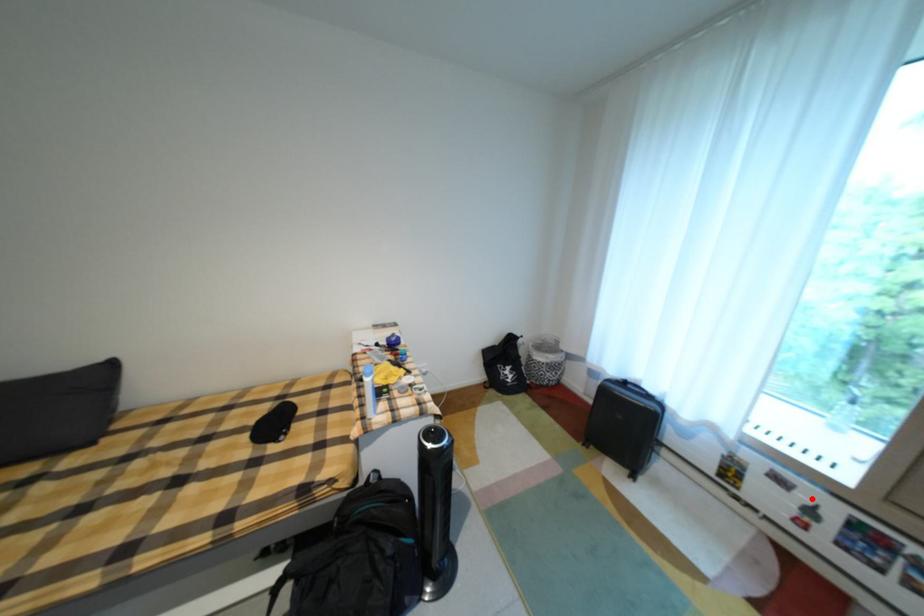
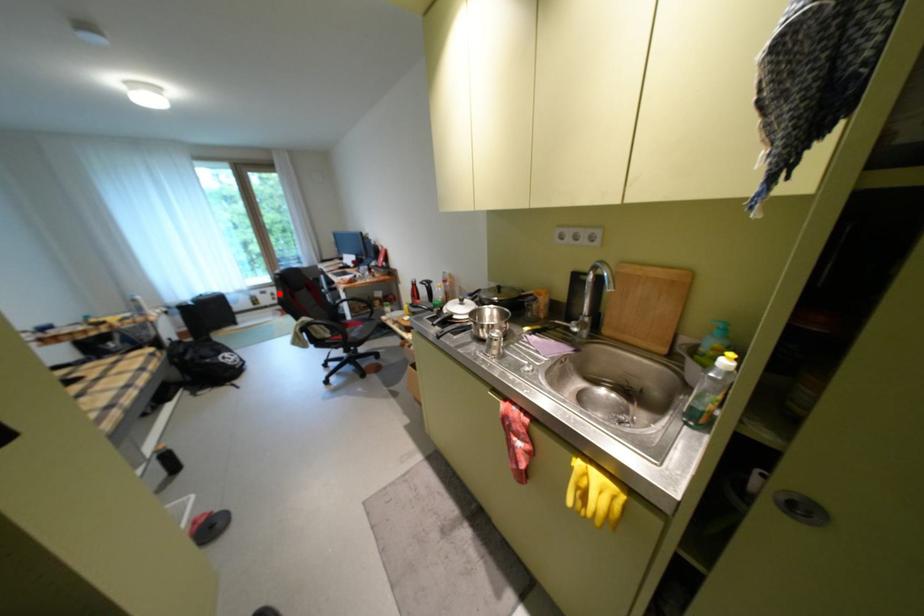
I am providing you with two images of the same scene from different viewpoints. A red point is marked on the first image and another point is marked on the second image. Is the marked point in image1 the same physical position as the marked point in image2?

Yes